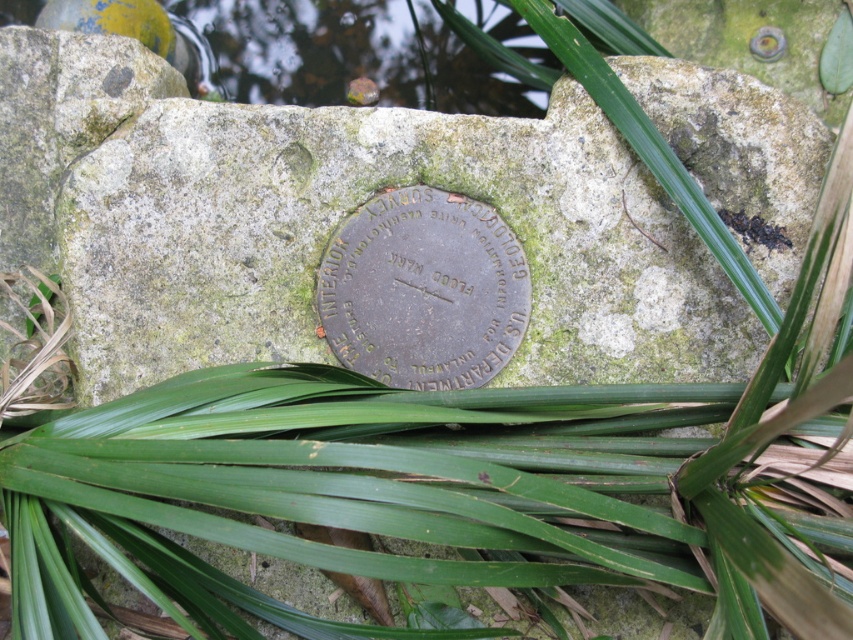
What are the coordinates of the green mossy stone at center in the image?

The coordinates of the green mossy stone at center are at point (355, 209).

What is the position of the green mossy stone at center relative to the bronze metallic plaque at center?

The green mossy stone at center is to the right of the bronze metallic plaque at center.

You are a geologist examining the stone structure. You notice the green mossy stone at center and the bronze metallic plaque at center. Which object is closer to your viewpoint?

The green mossy stone at center is closer to your viewpoint as it is positioned in front of the bronze metallic plaque at center.